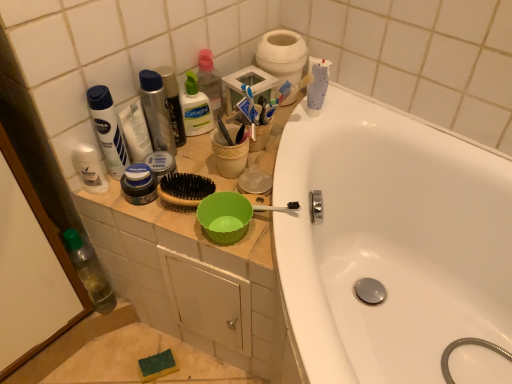
The image size is (512, 384). Identify the location of free space in front of metallic silver mouthwash at center, which ranks as the 1th mouthwash in right-to-left order. (183, 170).